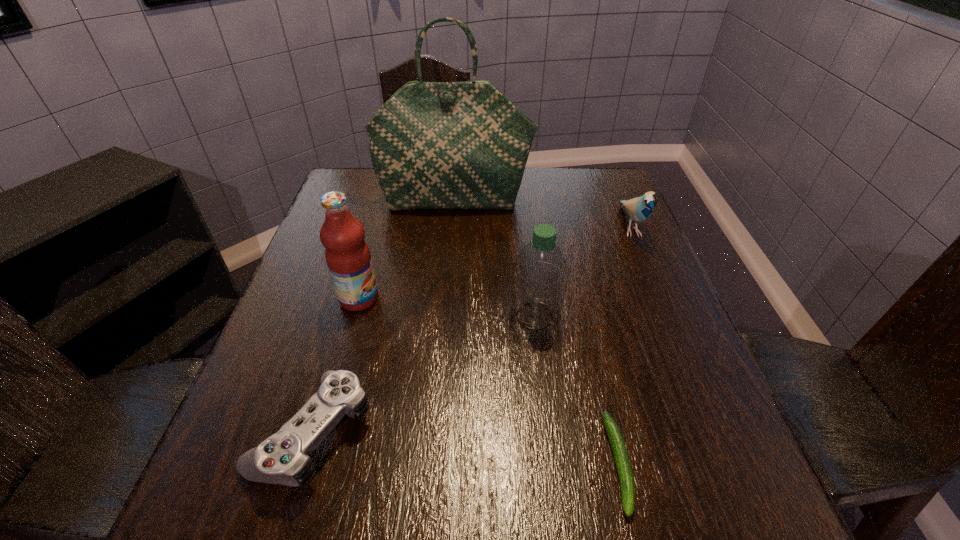
I want to click on tote bag, so click(434, 145).

Locate an element on the screen. The height and width of the screenshot is (540, 960). fruit juice is located at coordinates (348, 258).

Image resolution: width=960 pixels, height=540 pixels. What are the coordinates of `water bottle` in the screenshot? It's located at (539, 276).

Where is `the third shortest object`? Image resolution: width=960 pixels, height=540 pixels. the third shortest object is located at coordinates 639,209.

I want to click on the rightmost object, so click(639, 209).

Where is `control`? This screenshot has width=960, height=540. control is located at coordinates (283, 458).

Where is `zucchini`? The image size is (960, 540). zucchini is located at coordinates (623, 465).

At what (x,y) coordinates should I click in order to perform the action: click on the fifth object from left to right. Please return your answer as a coordinate pair (x, y). Looking at the image, I should click on (623, 465).

Locate an element on the screen. The image size is (960, 540). free space located 0.300m on the front of the tallest object is located at coordinates (448, 292).

This screenshot has width=960, height=540. I want to click on vacant space located 0.240m on the front label of the fruit juice, so click(488, 298).